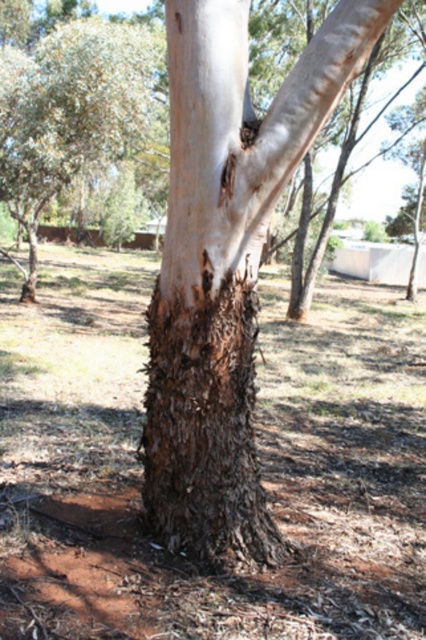
You are standing in a natural outdoor setting and see the brown rough bark at center. Can you determine its exact location in terms of coordinates?

The brown rough bark at center is located at point (201, 376).

In the scene shown: You are an arborist examining the tree trunk. You notice two areas of rough bark. One is labeled as brown rough bark at center and the other as rough bark tree at center. Which area has a larger size?

The brown rough bark at center is bigger than the rough bark tree at center.